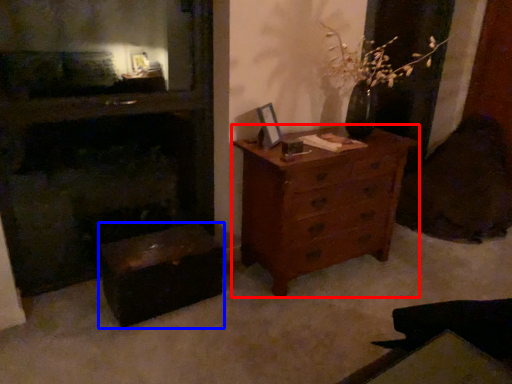
Question: Which point is further to the camera, chest of drawers (highlighted by a red box) or vanity (highlighted by a blue box)?

Choices:
 (A) chest of drawers
 (B) vanity

Answer: (A)